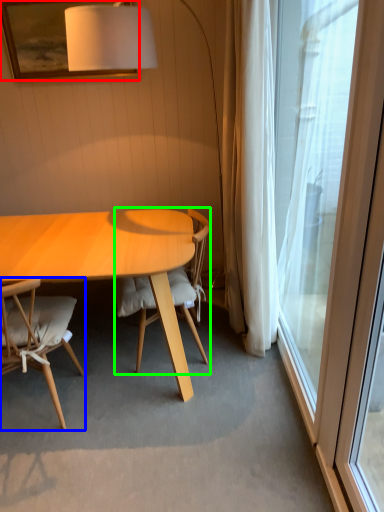
Question: Which is farther away from picture frame (highlighted by a red box)? chair (highlighted by a blue box) or chair (highlighted by a green box)?

Choices:
 (A) chair
 (B) chair

Answer: (A)